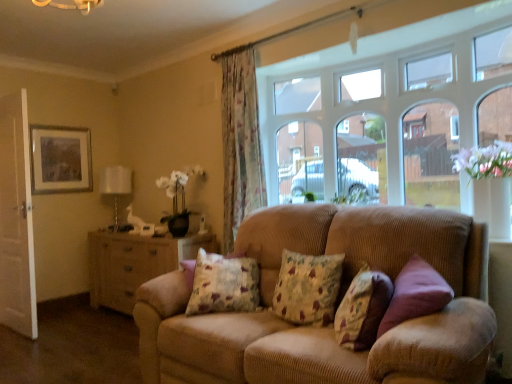
Question: Considering the positions of floral fabric cushion at center, the third pillow positioned from the right, and corduroy couch at center in the image, is floral fabric cushion at center, the third pillow positioned from the right, bigger or smaller than corduroy couch at center?

Choices:
 (A) small
 (B) big

Answer: (A)

Question: From a real-world perspective, is floral fabric cushion at center, the third pillow positioned from the right, physically located above or below corduroy couch at center?

Choices:
 (A) below
 (B) above

Answer: (B)

Question: Which object is the closest to the green leafy plant at upper center?

Choices:
 (A) wooden dresser at left
 (B) white fabric lampshade at left
 (C) matte gold picture frame at upper left
 (D) white wooden door at left
 (E) clear glass window at upper center

Answer: (E)

Question: Estimate the real-world distances between objects in this image. Which object is farther from the clear glass window at upper center?

Choices:
 (A) matte gold picture frame at upper left
 (B) green leafy plant at upper center
 (C) floral fabric cushion at center, acting as the third pillow starting from the left
 (D) white wooden door at left
 (E) floral fabric cushion at center, the third pillow positioned from the right

Answer: (A)